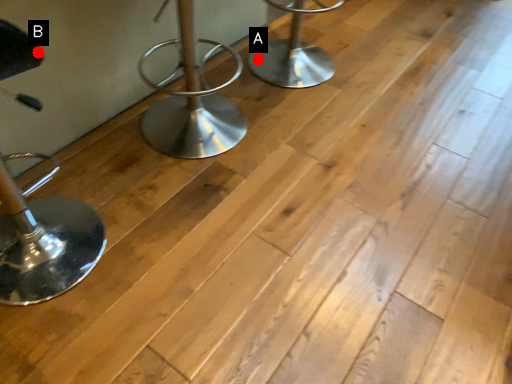
Question: Two points are circled on the image, labeled by A and B beside each circle. Which point is farther to the camera?

Choices:
 (A) A is further
 (B) B is further

Answer: (A)